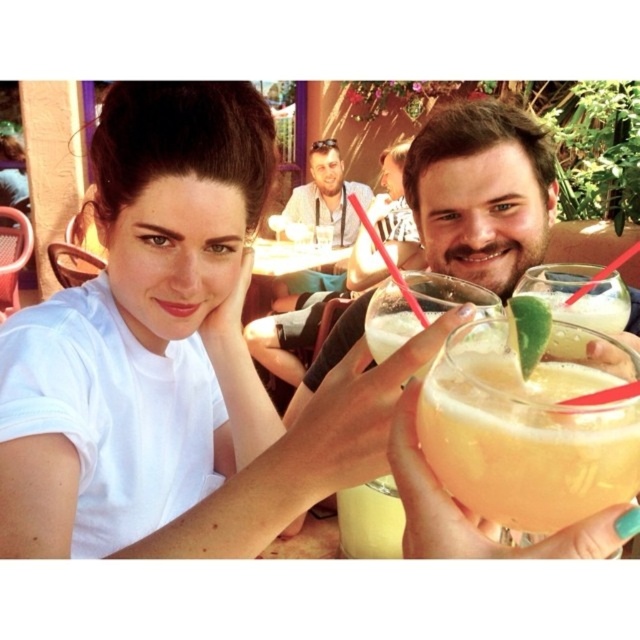
Is matte white shirt at center thinner than white glossy table at center?

Incorrect, matte white shirt at center's width is not less than white glossy table at center's.

Image resolution: width=640 pixels, height=640 pixels. Describe the element at coordinates (326, 196) in the screenshot. I see `matte white shirt at center` at that location.

You are a GUI agent. You are given a task and a screenshot of the screen. Output one action in this format:
    pyautogui.click(x=<x>, y=<y>)
    Task: Click on the matte white shirt at center
    
    Given the screenshot: What is the action you would take?
    pyautogui.click(x=326, y=196)

Who is shorter, translucent yellow drink at center or matte white shirt at center?

With less height is translucent yellow drink at center.

Between translucent yellow drink at center and matte white shirt at center, which one appears on the right side from the viewer's perspective?

translucent yellow drink at center

Measure the distance between translucent yellow drink at center and camera.

A distance of 10.60 inches exists between translucent yellow drink at center and camera.

Locate an element on the screen. translucent yellow drink at center is located at coordinates (522, 445).

Which of these two, translucent yellow drink at center or translucent glass at center, stands shorter?

translucent yellow drink at center is shorter.

Does point (618, 454) come closer to viewer compared to point (397, 294)?

Yes, it is.

Where is `translucent yellow drink at center`? Image resolution: width=640 pixels, height=640 pixels. translucent yellow drink at center is located at coordinates (522, 445).